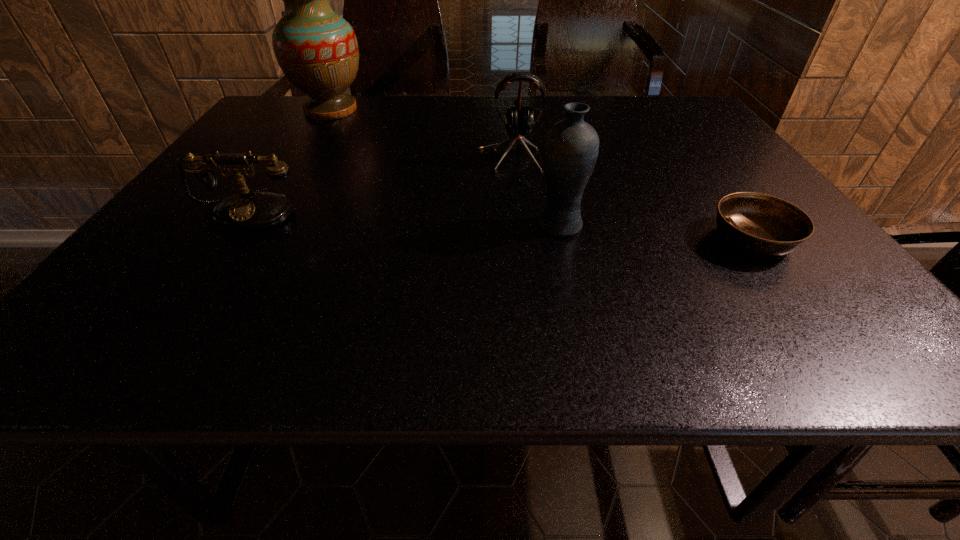
Identify the location of free spot at the near edge of the desktop. (666, 346).

This screenshot has height=540, width=960. In order to click on vacant space at the right edge in this screenshot , I will do [716, 204].

The height and width of the screenshot is (540, 960). I want to click on vacant space at the near left corner, so click(x=111, y=339).

Image resolution: width=960 pixels, height=540 pixels. Identify the location of free point between the telephone and the earphone. (380, 184).

Where is `vacant area that lies between the left vase and the shorter vase`? The height and width of the screenshot is (540, 960). vacant area that lies between the left vase and the shorter vase is located at coordinates (445, 167).

At what (x,y) coordinates should I click in order to perform the action: click on free space between the fourth tallest object and the farthest object. Please return your answer as a coordinate pair (x, y). The width and height of the screenshot is (960, 540). Looking at the image, I should click on (291, 160).

At what (x,y) coordinates should I click in order to perform the action: click on free space that is in between the shortest object and the left vase. Please return your answer as a coordinate pair (x, y). This screenshot has width=960, height=540. Looking at the image, I should click on (541, 174).

You are a GUI agent. You are given a task and a screenshot of the screen. Output one action in this format:
    pyautogui.click(x=<x>, y=<y>)
    Task: Click on the blank region between the shortest object and the right vase
    
    Given the screenshot: What is the action you would take?
    pyautogui.click(x=656, y=232)

Locate an element on the screen. unoccupied position between the third tallest object and the telephone is located at coordinates (380, 184).

Locate an element on the screen. The image size is (960, 540). free space between the telephone and the taller vase is located at coordinates (291, 160).